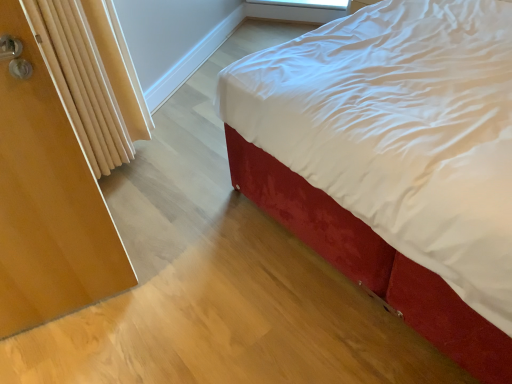
Question: Can you confirm if wooden screen door at left is taller than velvet red bed at center?

Choices:
 (A) no
 (B) yes

Answer: (B)

Question: Does wooden screen door at left come in front of velvet red bed at center?

Choices:
 (A) yes
 (B) no

Answer: (B)

Question: Does wooden screen door at left appear on the right side of velvet red bed at center?

Choices:
 (A) yes
 (B) no

Answer: (B)

Question: Is wooden screen door at left surrounding velvet red bed at center?

Choices:
 (A) no
 (B) yes

Answer: (A)

Question: Would you say wooden screen door at left is outside velvet red bed at center?

Choices:
 (A) yes
 (B) no

Answer: (A)

Question: Considering the positions of wooden radiator at left and velvet red bed at center in the image, is wooden radiator at left taller or shorter than velvet red bed at center?

Choices:
 (A) short
 (B) tall

Answer: (B)

Question: In the image, is wooden radiator at left positioned in front of or behind velvet red bed at center?

Choices:
 (A) behind
 (B) front

Answer: (A)

Question: Considering the positions of wooden radiator at left and velvet red bed at center in the image, is wooden radiator at left wider or thinner than velvet red bed at center?

Choices:
 (A) wide
 (B) thin

Answer: (B)

Question: From a real-world perspective, is wooden radiator at left above or below velvet red bed at center?

Choices:
 (A) above
 (B) below

Answer: (A)

Question: In terms of size, does wooden screen door at left appear bigger or smaller than transparent plastic window screen at upper center?

Choices:
 (A) small
 (B) big

Answer: (B)

Question: From their relative heights in the image, would you say wooden screen door at left is taller or shorter than transparent plastic window screen at upper center?

Choices:
 (A) tall
 (B) short

Answer: (A)

Question: Visually, is wooden screen door at left positioned to the left or to the right of transparent plastic window screen at upper center?

Choices:
 (A) left
 (B) right

Answer: (A)

Question: From the image's perspective, is wooden screen door at left above or below transparent plastic window screen at upper center?

Choices:
 (A) above
 (B) below

Answer: (B)

Question: Does point (79, 13) appear closer or farther from the camera than point (89, 258)?

Choices:
 (A) farther
 (B) closer

Answer: (A)

Question: Is wooden radiator at left wider or thinner than wooden screen door at left?

Choices:
 (A) wide
 (B) thin

Answer: (A)